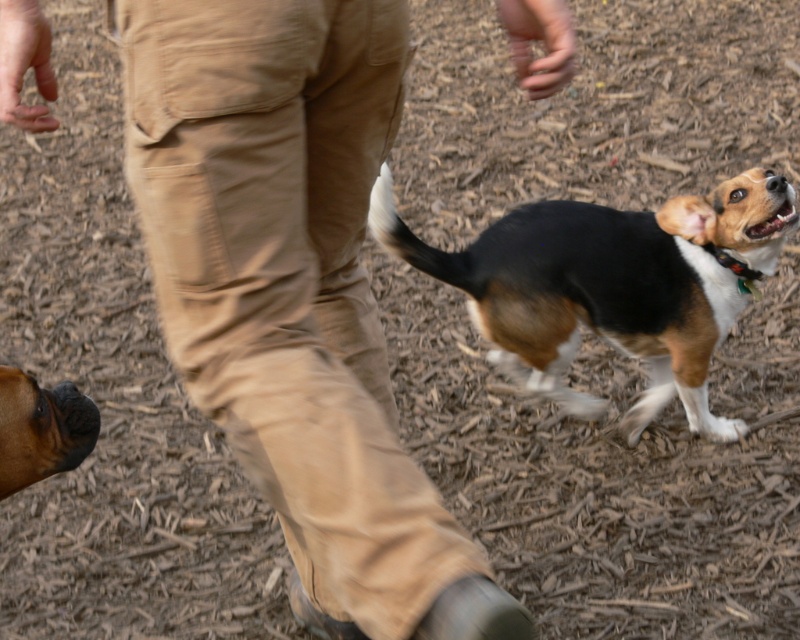
You are a dog trainer who needs to separate the two dogs for safety. The minimum safe distance required between them is 1.5 meters. Can you confirm if the current distance between the black and tan fur dog at center and the brown glossy dog at lower left is sufficient?

The distance between the black and tan fur dog at center and the brown glossy dog at lower left is 1.24 meters, which is less than the required 1.5 meters. Therefore, the current distance is insufficient, and the dogs need to be moved farther apart to meet safety standards.